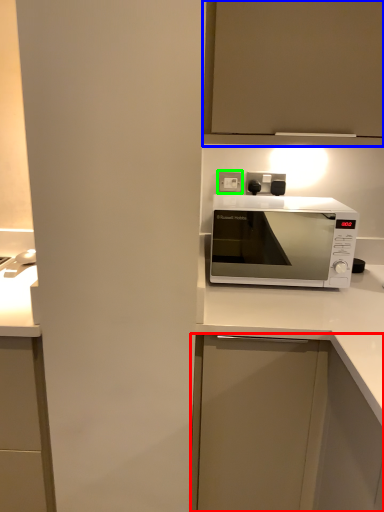
Question: Estimate the real-world distances between objects in this image. Which object is closer to cabinetry (highlighted by a red box), cabinetry (highlighted by a blue box) or electric outlet (highlighted by a green box)?

Choices:
 (A) cabinetry
 (B) electric outlet

Answer: (B)